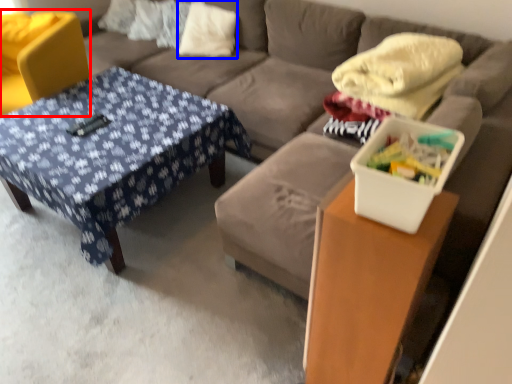
Question: Which object appears farthest to the camera in this image, swivel chair (highlighted by a red box) or pillow (highlighted by a blue box)?

Choices:
 (A) swivel chair
 (B) pillow

Answer: (B)